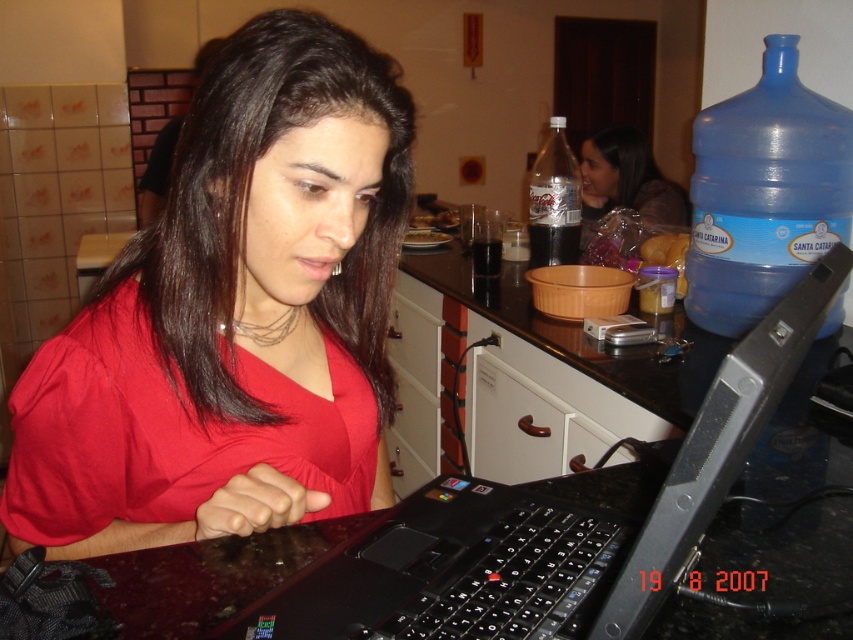
Question: Can you confirm if black plastic laptop at center is bigger than blue plastic bottle at upper right?

Choices:
 (A) no
 (B) yes

Answer: (B)

Question: Does black plastic laptop at center have a lesser width compared to blue plastic bottle at upper right?

Choices:
 (A) no
 (B) yes

Answer: (A)

Question: Which object appears closest to the camera in this image?

Choices:
 (A) black plastic laptop at center
 (B) clear plastic bottle at center

Answer: (A)

Question: Can you confirm if black plastic laptop at center is smaller than clear plastic bottle at center?

Choices:
 (A) yes
 (B) no

Answer: (A)

Question: Which point appears farthest from the camera in this image?

Choices:
 (A) (801, 134)
 (B) (196, 330)

Answer: (A)

Question: Which object appears farthest from the camera in this image?

Choices:
 (A) matte red shirt at center
 (B) black plastic laptop at center
 (C) matte black laptop at center
 (D) clear plastic bottle at center

Answer: (C)